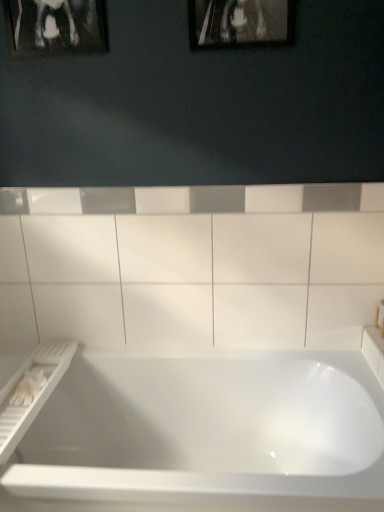
Question: Is black glossy picture frame at upper left, acting as the second picture frame starting from the right, far from white glossy ceramic tile at center?

Choices:
 (A) no
 (B) yes

Answer: (A)

Question: From the image's perspective, is black glossy picture frame at upper left, the first picture frame positioned from the left, above white glossy ceramic tile at center?

Choices:
 (A) yes
 (B) no

Answer: (A)

Question: Is black glossy picture frame at upper left, the first picture frame positioned from the left, bigger than white glossy ceramic tile at center?

Choices:
 (A) no
 (B) yes

Answer: (A)

Question: Considering the relative sizes of black glossy picture frame at upper left, acting as the second picture frame starting from the right, and white glossy ceramic tile at center in the image provided, is black glossy picture frame at upper left, acting as the second picture frame starting from the right, wider than white glossy ceramic tile at center?

Choices:
 (A) no
 (B) yes

Answer: (B)

Question: Is black glossy picture frame at upper left, the first picture frame positioned from the left, positioned with its back to white glossy ceramic tile at center?

Choices:
 (A) no
 (B) yes

Answer: (A)

Question: In terms of width, does black glossy picture frame at upper left, the first picture frame positioned from the left, look wider or thinner when compared to white glossy bathtub at center?

Choices:
 (A) wide
 (B) thin

Answer: (B)

Question: Is black glossy picture frame at upper left, acting as the second picture frame starting from the right, to the left or to the right of white glossy bathtub at center in the image?

Choices:
 (A) left
 (B) right

Answer: (A)

Question: Based on their sizes in the image, would you say black glossy picture frame at upper left, acting as the second picture frame starting from the right, is bigger or smaller than white glossy bathtub at center?

Choices:
 (A) big
 (B) small

Answer: (B)

Question: From the image's perspective, relative to white glossy bathtub at center, is black glossy picture frame at upper left, the first picture frame positioned from the left, above or below?

Choices:
 (A) above
 (B) below

Answer: (A)

Question: Visually, is white glossy ceramic tile at center positioned to the left or to the right of white glossy bathtub at center?

Choices:
 (A) left
 (B) right

Answer: (B)

Question: Considering the positions of white glossy ceramic tile at center and white glossy bathtub at center in the image, is white glossy ceramic tile at center taller or shorter than white glossy bathtub at center?

Choices:
 (A) short
 (B) tall

Answer: (B)

Question: Is white glossy ceramic tile at center spatially inside white glossy bathtub at center, or outside of it?

Choices:
 (A) inside
 (B) outside

Answer: (B)

Question: Is white glossy ceramic tile at center bigger or smaller than white glossy bathtub at center?

Choices:
 (A) big
 (B) small

Answer: (B)

Question: In terms of height, does metallic silver picture frame at upper center, the 1th picture frame from the right, look taller or shorter compared to white glossy bathtub at center?

Choices:
 (A) tall
 (B) short

Answer: (B)

Question: Considering the positions of point (215, 30) and point (249, 410), is point (215, 30) closer or farther from the camera than point (249, 410)?

Choices:
 (A) farther
 (B) closer

Answer: (B)